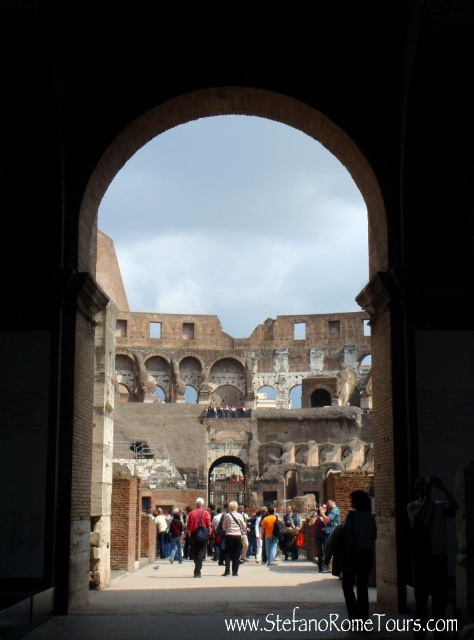
You are a photographer standing in the Colosseum and want to take a photo of the denim jacket at center and the red fabric backpack at center. Which object should you focus on first if you want to capture both clearly in the same frame?

The denim jacket at center has a greater height compared to the red fabric backpack at center. Therefore, you should focus on the denim jacket at center first as it is taller and might require more attention in the frame.

You are a tour guide leading a group through the Colosseum. You notice a dark blue fabric backpack at center and a denim jacket at center. Which item is narrower?

The dark blue fabric backpack at center is narrower than the denim jacket at center.